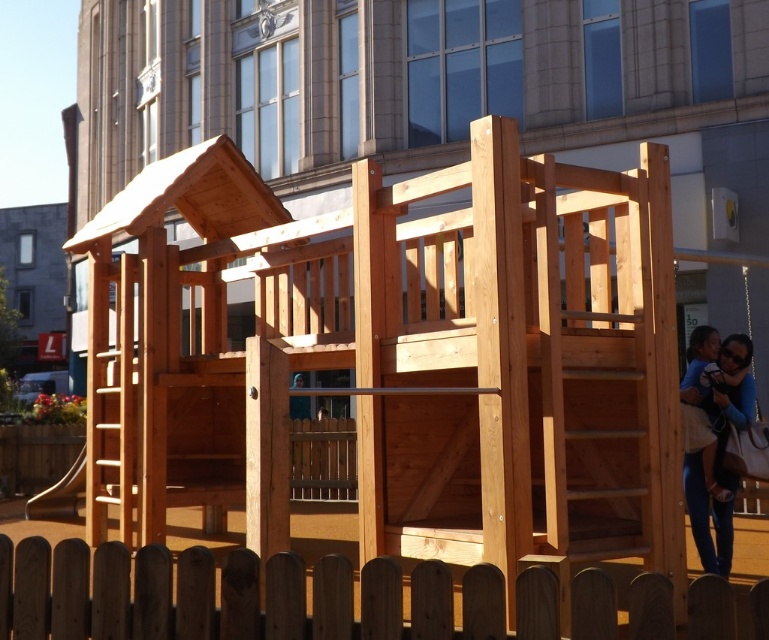
Question: Does brown wooden fence at lower center have a larger size compared to smooth brown slide at lower left?

Choices:
 (A) yes
 (B) no

Answer: (B)

Question: Is brown wooden fence at lower center wider than smooth brown slide at lower left?

Choices:
 (A) yes
 (B) no

Answer: (A)

Question: Among these objects, which one is farthest from the camera?

Choices:
 (A) brown wooden fence at center
 (B) smooth brown slide at lower left
 (C) brown wooden fence at lower center

Answer: (A)

Question: Is brown wooden fence at center to the right of smooth brown slide at lower left from the viewer's perspective?

Choices:
 (A) no
 (B) yes

Answer: (B)

Question: Which point appears closest to the camera in this image?

Choices:
 (A) pos(348,474)
 (B) pos(78,474)
 (C) pos(180,577)

Answer: (C)

Question: Which point is farther to the camera?

Choices:
 (A) smooth brown slide at lower left
 (B) brown wooden fence at lower center
 (C) brown wooden fence at center

Answer: (C)